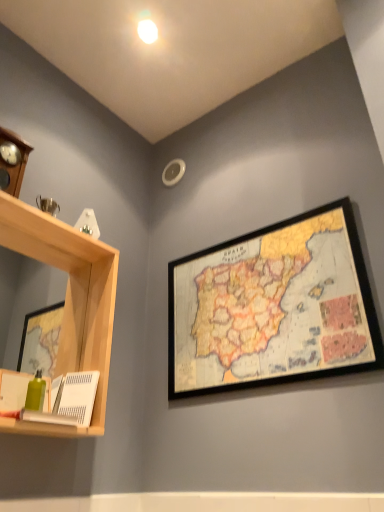
Question: Is point (38, 234) positioned closer to the camera than point (360, 332)?

Choices:
 (A) closer
 (B) farther

Answer: (B)

Question: Is light wood shelf at left inside the boundaries of wooden framed map at upper right, or outside?

Choices:
 (A) outside
 (B) inside

Answer: (A)

Question: In terms of height, does light wood shelf at left look taller or shorter compared to wooden framed map at upper right?

Choices:
 (A) short
 (B) tall

Answer: (B)

Question: From a real-world perspective, is wooden framed map at upper right positioned above or below light wood shelf at left?

Choices:
 (A) below
 (B) above

Answer: (B)

Question: Considering the positions of wooden framed map at upper right and light wood shelf at left in the image, is wooden framed map at upper right wider or thinner than light wood shelf at left?

Choices:
 (A) thin
 (B) wide

Answer: (A)

Question: Would you say wooden framed map at upper right is inside or outside light wood shelf at left?

Choices:
 (A) inside
 (B) outside

Answer: (B)

Question: In the image, is wooden framed map at upper right positioned in front of or behind light wood shelf at left?

Choices:
 (A) front
 (B) behind

Answer: (B)